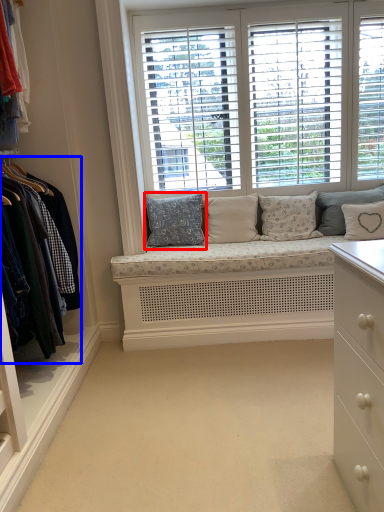
Question: Which of the following is the closest to the observer, pillow (highlighted by a red box) or closet (highlighted by a blue box)?

Choices:
 (A) pillow
 (B) closet

Answer: (B)